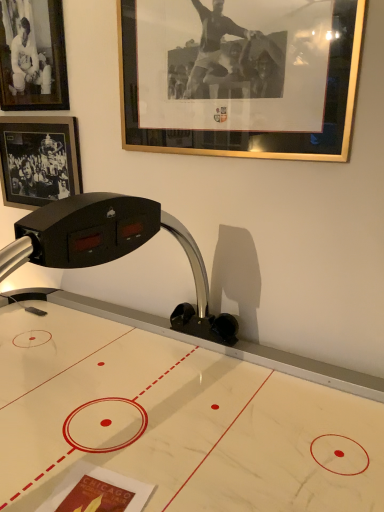
Question: From the image's perspective, is matte black photo frame at upper left, which appears as the 2th picture frame when viewed from the left, above or below white glossy air hockey table at center?

Choices:
 (A) below
 (B) above

Answer: (B)

Question: Which is correct: matte black photo frame at upper left, positioned as the 2th picture frame in right-to-left order, is inside white glossy air hockey table at center, or outside of it?

Choices:
 (A) outside
 (B) inside

Answer: (A)

Question: Which object is positioned farthest from the gold-framed picture at upper center, placed as the third picture frame when sorted from left to right?

Choices:
 (A) matte black photo frame at upper left, positioned as the 2th picture frame in right-to-left order
 (B) black matte picture frame at upper left, the first picture frame when ordered from left to right
 (C) white glossy air hockey table at center

Answer: (C)

Question: Which is nearer to the black matte picture frame at upper left, the first picture frame when ordered from left to right?

Choices:
 (A) gold-framed picture at upper center, which ranks as the 1th picture frame in right-to-left order
 (B) matte black photo frame at upper left, which appears as the 2th picture frame when viewed from the left
 (C) white glossy air hockey table at center

Answer: (B)